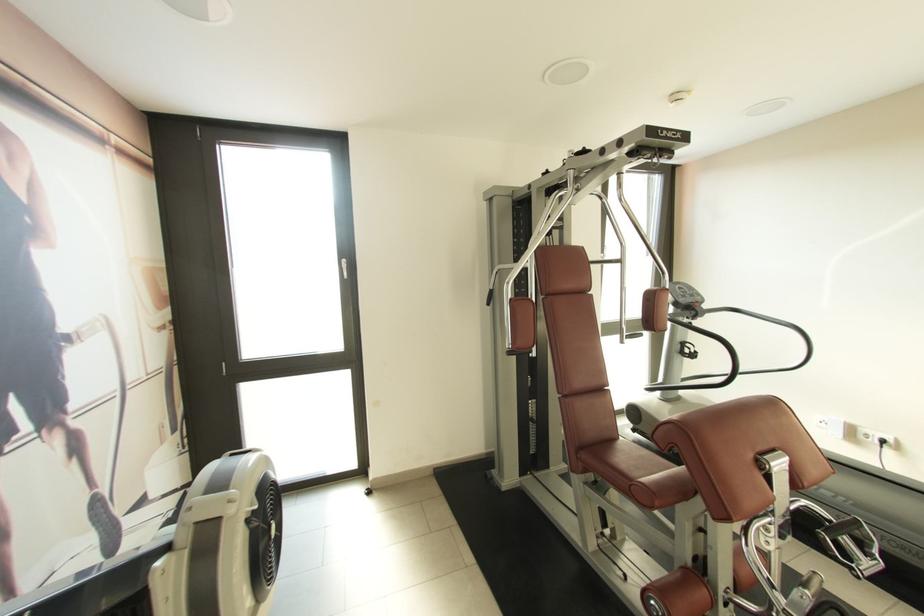
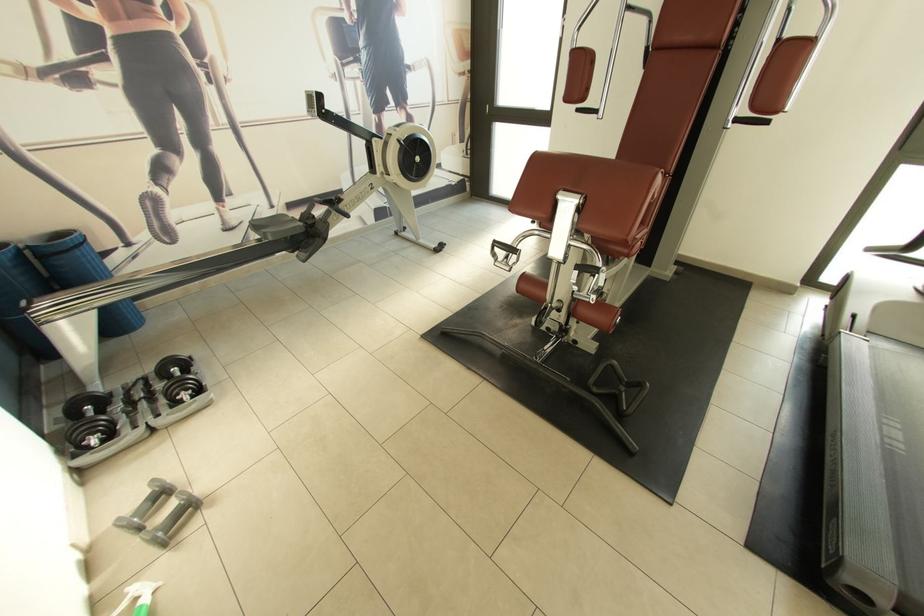
In the second image, find the point that corresponds to [228,365] in the first image.

(492, 107)